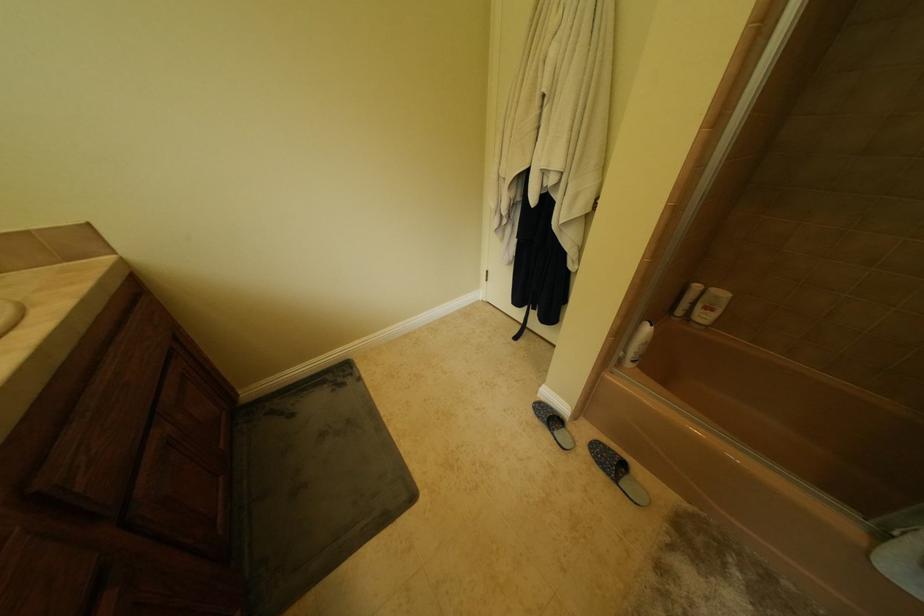
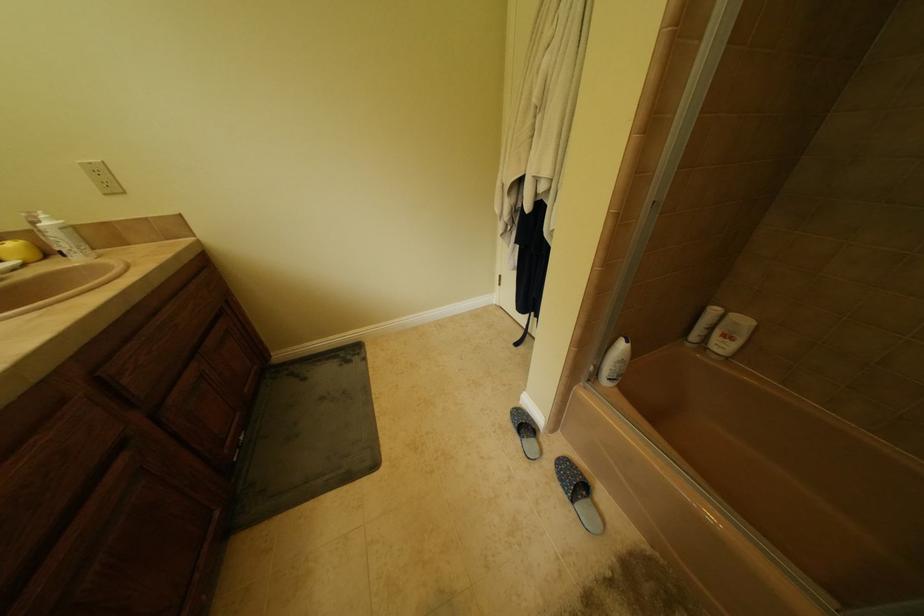
Question: Which direction would the cameraman need to move to produce the second image? Reply with the corresponding letter.

Choices:
 (A) Left
 (B) Right
 (C) Forward
 (D) Backward

Answer: (B)